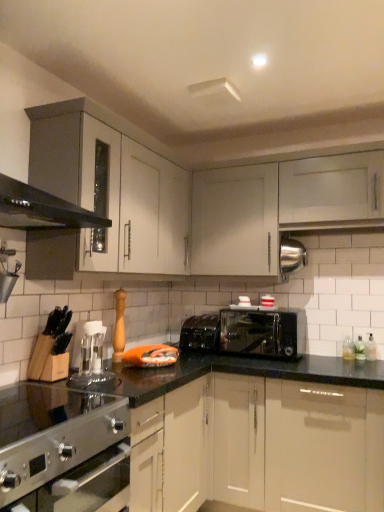
Describe the element at coordinates (54, 410) in the screenshot. This screenshot has width=384, height=512. I see `satin silver gas stove at lower left` at that location.

Describe the element at coordinates (263, 332) in the screenshot. I see `black plastic toaster at center` at that location.

What is the approximate height of white glossy cabinet at upper right, arranged as the first cabinetry when viewed from the right?

white glossy cabinet at upper right, arranged as the first cabinetry when viewed from the right, is 19.19 inches tall.

What do you see at coordinates (200, 333) in the screenshot?
I see `black metallic toaster at center` at bounding box center [200, 333].

The width and height of the screenshot is (384, 512). What do you see at coordinates (235, 221) in the screenshot?
I see `white matte cabinet at upper center, the first cabinetry from the left` at bounding box center [235, 221].

Measure the distance between point [43,500] and camera.

They are 4.07 feet apart.

I want to click on transparent plastic coffee machine at center, so click(x=90, y=355).

Who is taller, white glossy cabinet at upper right, arranged as the first cabinetry when viewed from the right, or satin silver oven at lower left?

Standing taller between the two is white glossy cabinet at upper right, arranged as the first cabinetry when viewed from the right.

Is white glossy cabinet at upper right, arranged as the first cabinetry when viewed from the right, aimed at satin silver oven at lower left?

No.

Can you tell me how much white glossy cabinet at upper right, arranged as the first cabinetry when viewed from the right, and satin silver oven at lower left differ in facing direction?

The angle between the facing direction of white glossy cabinet at upper right, arranged as the first cabinetry when viewed from the right, and the facing direction of satin silver oven at lower left is 90.2 degrees.

From the image's perspective, would you say white glossy cabinet at upper right, which ranks as the second cabinetry in left-to-right order, is positioned over satin silver oven at lower left?

Indeed, from the image's perspective, white glossy cabinet at upper right, which ranks as the second cabinetry in left-to-right order, is shown above satin silver oven at lower left.

Could you measure the distance between clear glass bottle at lower right and white glossy cabinet at upper right, which ranks as the second cabinetry in left-to-right order?

The distance of clear glass bottle at lower right from white glossy cabinet at upper right, which ranks as the second cabinetry in left-to-right order, is 94.96 centimeters.

Is clear glass bottle at lower right oriented towards white glossy cabinet at upper right, arranged as the first cabinetry when viewed from the right?

No, clear glass bottle at lower right is not facing towards white glossy cabinet at upper right, arranged as the first cabinetry when viewed from the right.

Does point (370, 333) come behind point (313, 222)?

Yes, it is behind point (313, 222).

From a real-world perspective, which is physically above, clear glass bottle at lower right or white glossy cabinet at upper right, which ranks as the second cabinetry in left-to-right order?

white glossy cabinet at upper right, which ranks as the second cabinetry in left-to-right order.

Considering the positions of objects satin silver oven at lower left and white matte cabinet at upper center, the second cabinetry when ordered from right to left, in the image provided, who is more to the right, satin silver oven at lower left or white matte cabinet at upper center, the second cabinetry when ordered from right to left,?

From the viewer's perspective, white matte cabinet at upper center, the second cabinetry when ordered from right to left, appears more on the right side.

Between point (66, 489) and point (196, 249), which one is positioned behind?

The point (196, 249) is more distant.

Which of these two, satin silver oven at lower left or white matte cabinet at upper center, the second cabinetry when ordered from right to left, is thinner?

white matte cabinet at upper center, the second cabinetry when ordered from right to left, is thinner.

Where is `gas stove in front of the black plastic toaster at center`? The height and width of the screenshot is (512, 384). gas stove in front of the black plastic toaster at center is located at coordinates (54, 410).

Does black plastic toaster at center have a smaller size compared to satin silver gas stove at lower left?

Correct, black plastic toaster at center occupies less space than satin silver gas stove at lower left.

Is black plastic toaster at center facing towards satin silver gas stove at lower left?

Yes, black plastic toaster at center is aimed at satin silver gas stove at lower left.

How distant is black plastic toaster at center from satin silver gas stove at lower left?

black plastic toaster at center and satin silver gas stove at lower left are 1.35 meters apart.

Considering the relative sizes of satin silver gas stove at lower left and white glossy cabinet at upper right, which ranks as the second cabinetry in left-to-right order, in the image provided, is satin silver gas stove at lower left shorter than white glossy cabinet at upper right, which ranks as the second cabinetry in left-to-right order,?

Yes, satin silver gas stove at lower left is shorter than white glossy cabinet at upper right, which ranks as the second cabinetry in left-to-right order.

What's the angular difference between satin silver gas stove at lower left and white glossy cabinet at upper right, which ranks as the second cabinetry in left-to-right order,'s facing directions?

There is a 90.4-degree angle between the facing directions of satin silver gas stove at lower left and white glossy cabinet at upper right, which ranks as the second cabinetry in left-to-right order.

From a real-world perspective, is satin silver gas stove at lower left physically below white glossy cabinet at upper right, arranged as the first cabinetry when viewed from the right?

Yes, from a real-world perspective, satin silver gas stove at lower left is beneath white glossy cabinet at upper right, arranged as the first cabinetry when viewed from the right.

Is point (34, 417) positioned behind point (356, 174)?

No, (34, 417) is in front of (356, 174).

From a real-world perspective, between satin silver oven at lower left and transparent plastic coffee machine at center, who is vertically lower?

satin silver oven at lower left, from a real-world perspective.

From the image's perspective, is satin silver oven at lower left positioned above or below transparent plastic coffee machine at center?

From the image's perspective, satin silver oven at lower left appears below transparent plastic coffee machine at center.

Is satin silver oven at lower left outside of transparent plastic coffee machine at center?

Yes.

From a real-world perspective, is black plastic toaster at center beneath white matte cabinet at upper center, the second cabinetry when ordered from right to left?

Indeed, from a real-world perspective, black plastic toaster at center is positioned beneath white matte cabinet at upper center, the second cabinetry when ordered from right to left.

Looking at this image, in the image, is black plastic toaster at center positioned in front of or behind white matte cabinet at upper center, the first cabinetry from the left?

Clearly, black plastic toaster at center is in front of white matte cabinet at upper center, the first cabinetry from the left.

Considering the relative sizes of black plastic toaster at center and white matte cabinet at upper center, the first cabinetry from the left, in the image provided, is black plastic toaster at center thinner than white matte cabinet at upper center, the first cabinetry from the left,?

No, black plastic toaster at center is not thinner than white matte cabinet at upper center, the first cabinetry from the left.

How different are the orientations of black plastic toaster at center and white matte cabinet at upper center, the second cabinetry when ordered from right to left, in degrees?

The angle between the facing direction of black plastic toaster at center and the facing direction of white matte cabinet at upper center, the second cabinetry when ordered from right to left, is 0.991 degrees.

Where is `the 1st cabinetry behind the satin silver oven at lower left, counting from the anchor's position`? The width and height of the screenshot is (384, 512). the 1st cabinetry behind the satin silver oven at lower left, counting from the anchor's position is located at coordinates (332, 190).

The height and width of the screenshot is (512, 384). I want to click on bottle below the white glossy cabinet at upper right, arranged as the first cabinetry when viewed from the right (from a real-world perspective), so click(371, 348).

Estimate the real-world distances between objects in this image. Which object is further from black plastic toaster at center, clear glass bottle at lower right or transparent plastic coffee machine at center?

The object further to black plastic toaster at center is transparent plastic coffee machine at center.

Estimate the real-world distances between objects in this image. Which object is further from black plastic toaster at center, satin silver gas stove at lower left or white glossy cabinet at upper right, arranged as the first cabinetry when viewed from the right?

satin silver gas stove at lower left.

Looking at the image, which one is located further to transparent plastic coffee machine at center, satin silver oven at lower left or black plastic toaster at center?

Based on the image, black plastic toaster at center appears to be further to transparent plastic coffee machine at center.

Looking at the image, which one is located closer to clear glass bottle at lower right, satin silver oven at lower left or transparent plastic coffee machine at center?

transparent plastic coffee machine at center is positioned closer to the anchor clear glass bottle at lower right.

Based on their spatial positions, is satin silver oven at lower left or black metallic toaster at center further from transparent plastic coffee machine at center?

black metallic toaster at center lies further to transparent plastic coffee machine at center than the other object.

From the image, which object appears to be nearer to satin silver oven at lower left, transparent plastic coffee machine at center or white matte cabinet at upper center, the second cabinetry when ordered from right to left?

transparent plastic coffee machine at center.

Estimate the real-world distances between objects in this image. Which object is further from black metallic toaster at center, black plastic toaster at center or transparent plastic coffee machine at center?

transparent plastic coffee machine at center.

Looking at the image, which one is located further to black metallic toaster at center, clear glass bottle at lower right or white matte cabinet at upper center, the first cabinetry from the left?

clear glass bottle at lower right is positioned further to the anchor black metallic toaster at center.

This screenshot has height=512, width=384. I want to click on cabinetry between white glossy cabinet at upper right, arranged as the first cabinetry when viewed from the right, and black plastic toaster at center in the up-down direction, so click(235, 221).

Identify the location of oven positioned between satin silver gas stove at lower left and black metallic toaster at center from near to far. The image size is (384, 512). (84, 486).

Find the location of `cabinetry between satin silver gas stove at lower left and white matte cabinet at upper center, the second cabinetry when ordered from right to left, in the front-back direction`. cabinetry between satin silver gas stove at lower left and white matte cabinet at upper center, the second cabinetry when ordered from right to left, in the front-back direction is located at coordinates (332, 190).

The image size is (384, 512). What are the coordinates of `toaster between satin silver gas stove at lower left and white glossy cabinet at upper right, which ranks as the second cabinetry in left-to-right order, from left to right` in the screenshot? It's located at (263, 332).